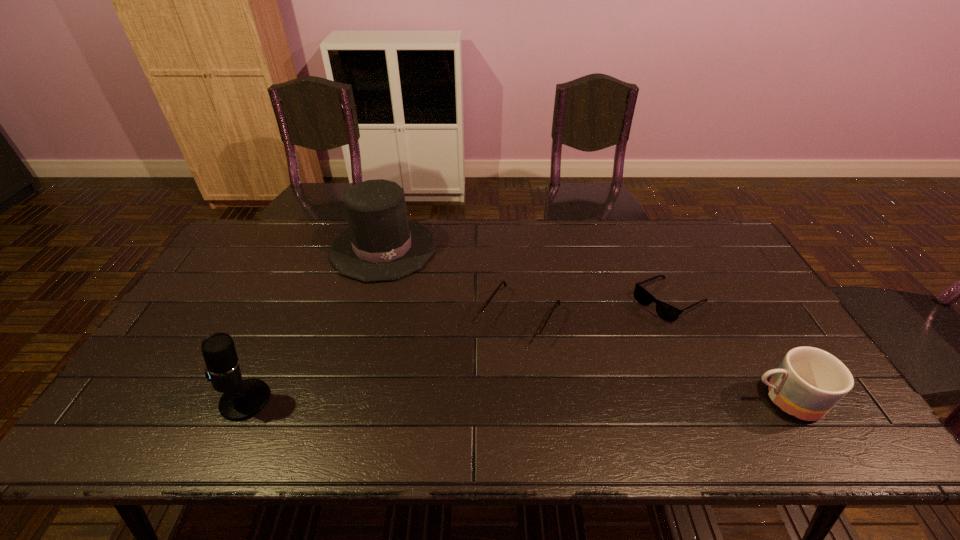
At what (x,y) coordinates should I click in order to perform the action: click on the leftmost object. Please return your answer as a coordinate pair (x, y). Looking at the image, I should click on (242, 399).

What are the coordinates of `mug` in the screenshot? It's located at (809, 382).

Identify the location of the third object from right to left. Image resolution: width=960 pixels, height=540 pixels. (528, 335).

Where is `sunglasses`? The image size is (960, 540). sunglasses is located at coordinates (665, 311).

Locate an element on the screen. Image resolution: width=960 pixels, height=540 pixels. dress hat is located at coordinates (381, 244).

I want to click on vacant space located on the left of the leftmost object, so click(127, 400).

This screenshot has height=540, width=960. In order to click on vacant space situated 0.230m on the side with the handle of the third tallest object in this screenshot , I will do `click(652, 400)`.

Locate an element on the screen. Image resolution: width=960 pixels, height=540 pixels. free space located 0.220m on the side with the handle of the third tallest object is located at coordinates (656, 400).

Where is `vacant space located 0.190m on the side with the handle of the third tallest object`? The width and height of the screenshot is (960, 540). vacant space located 0.190m on the side with the handle of the third tallest object is located at coordinates (668, 400).

Where is `vacant position located at the hinge ends of the third object from right to left`? vacant position located at the hinge ends of the third object from right to left is located at coordinates [x=495, y=357].